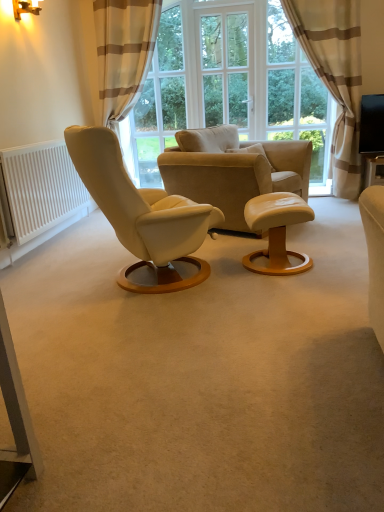
Where is `vacant area that lies to the right of matte white stool at center`? vacant area that lies to the right of matte white stool at center is located at coordinates (335, 259).